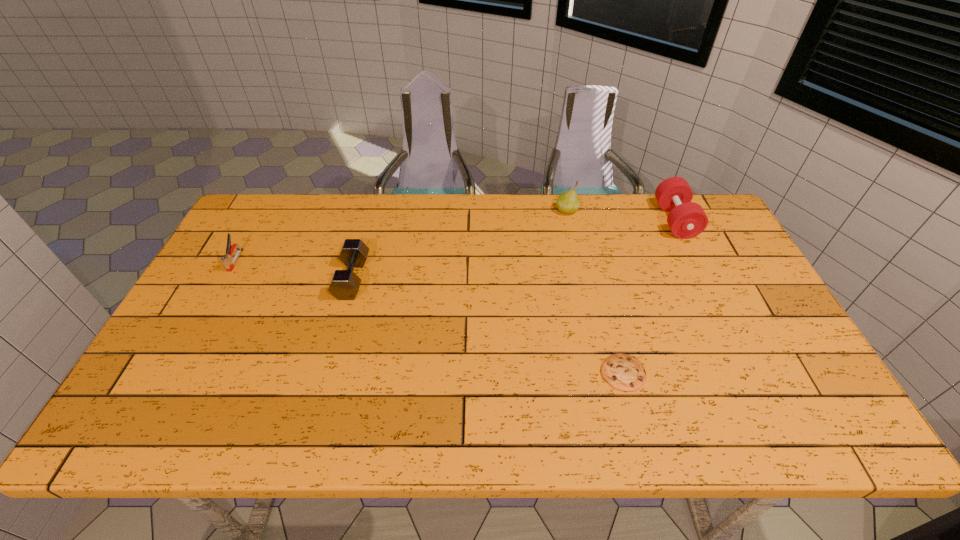
In order to click on free spot between the second object from left to right and the shortest object in this screenshot , I will do `click(488, 326)`.

This screenshot has height=540, width=960. What are the coordinates of `vacant space that is in between the stapler and the right dumbbell` in the screenshot? It's located at (455, 240).

Where is `free space between the rightmost object and the leftmost object`? The height and width of the screenshot is (540, 960). free space between the rightmost object and the leftmost object is located at coordinates (455, 240).

Select which object is the fourth closest to the right dumbbell. Please provide its 2D coordinates. Your answer should be formatted as a tuple, i.e. [(x, y)], where the tuple contains the x and y coordinates of a point satisfying the conditions above.

[(227, 260)]

Where is `object that is the fourth nearest to the stapler`? The image size is (960, 540). object that is the fourth nearest to the stapler is located at coordinates (686, 219).

Where is `free location that satisfies the following two spatial constraints: 1. on the back side of the pear; 2. on the left side of the left dumbbell`? free location that satisfies the following two spatial constraints: 1. on the back side of the pear; 2. on the left side of the left dumbbell is located at coordinates (372, 211).

Where is `vacant space that satisfies the following two spatial constraints: 1. on the front side of the cookie; 2. on the right side of the left dumbbell`? The height and width of the screenshot is (540, 960). vacant space that satisfies the following two spatial constraints: 1. on the front side of the cookie; 2. on the right side of the left dumbbell is located at coordinates click(x=326, y=373).

Locate an element on the screen. The image size is (960, 540). vacant space that satisfies the following two spatial constraints: 1. on the handle side of the nearer dumbbell; 2. on the left side of the stapler is located at coordinates (226, 278).

At what (x,y) coordinates should I click in order to perform the action: click on vacant space that satisfies the following two spatial constraints: 1. on the handle side of the stapler; 2. on the right side of the fourth object from right to left. Please return your answer as a coordinate pair (x, y). Looking at the image, I should click on (226, 278).